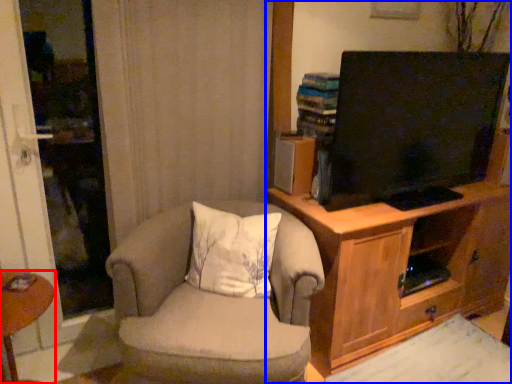
Question: Which point is closer to the camera, desk (highlighted by a red box) or cabinetry (highlighted by a blue box)?

Choices:
 (A) desk
 (B) cabinetry

Answer: (A)